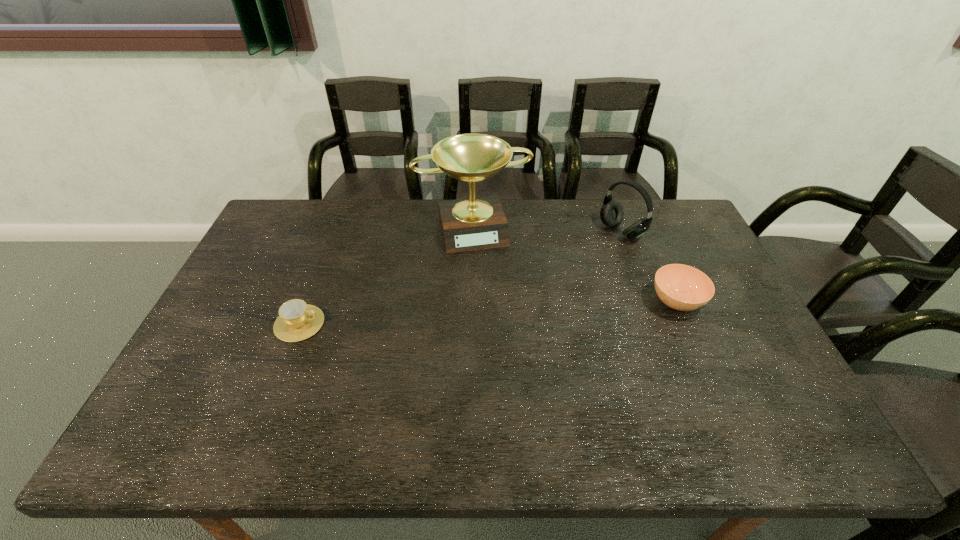
The height and width of the screenshot is (540, 960). In order to click on free space on the desktop that is between the shortest object and the soup bowl and is positioned on the front-facing side of the award in this screenshot , I will do `click(496, 312)`.

Identify the location of free spot on the desktop that is between the leftmost object and the soup bowl and is positioned on the ear cups of the second tallest object. (482, 313).